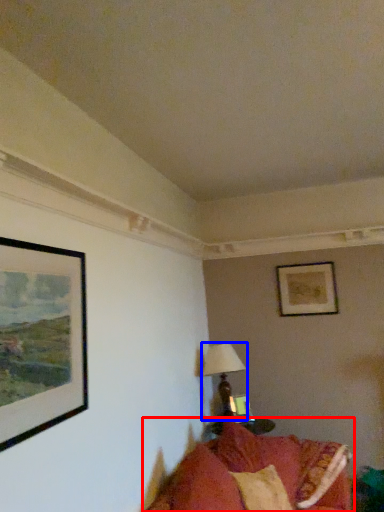
Question: Which of the following is the closest to the observer, studio couch (highlighted by a red box) or table lamp (highlighted by a blue box)?

Choices:
 (A) studio couch
 (B) table lamp

Answer: (A)